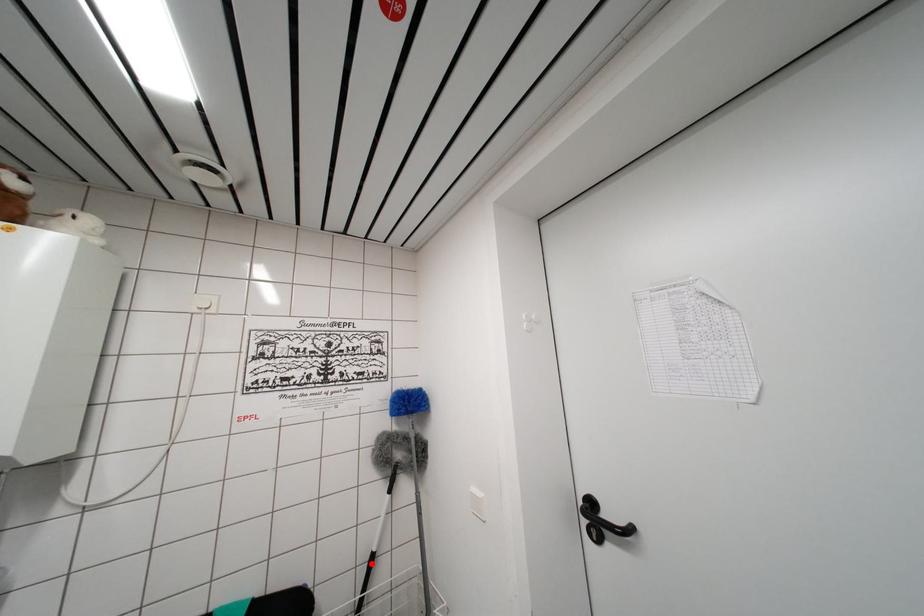
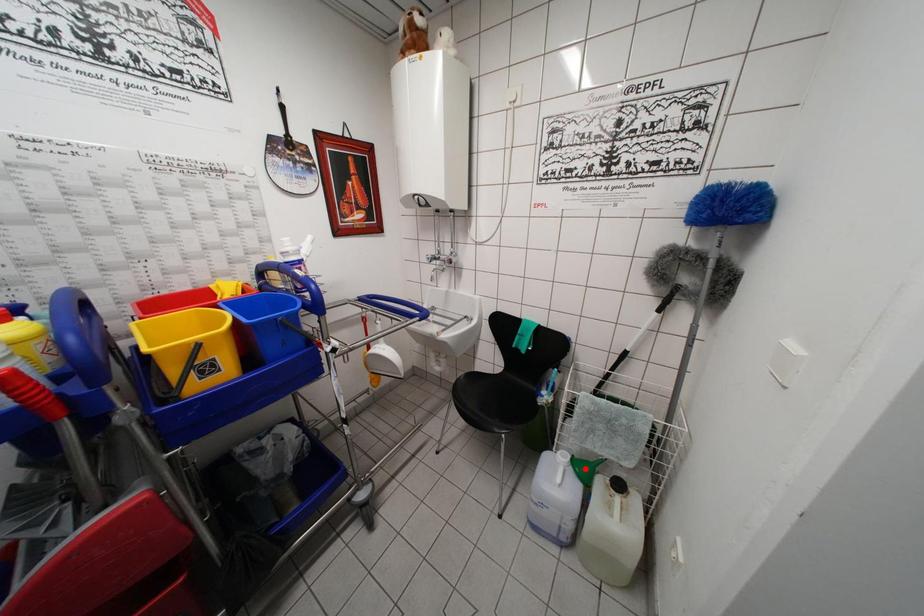
I am providing you with two images of the same scene from different viewpoints. A red point is marked on the first image and another point is marked on the second image. Is the marked point in image1 the same physical position as the marked point in image2?

No